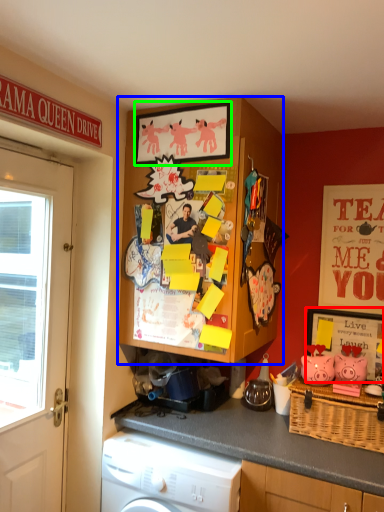
Question: Considering the real-world distances, which object is farthest from picture frame (highlighted by a red box)? cabinetry (highlighted by a blue box) or picture frame (highlighted by a green box)?

Choices:
 (A) cabinetry
 (B) picture frame

Answer: (B)